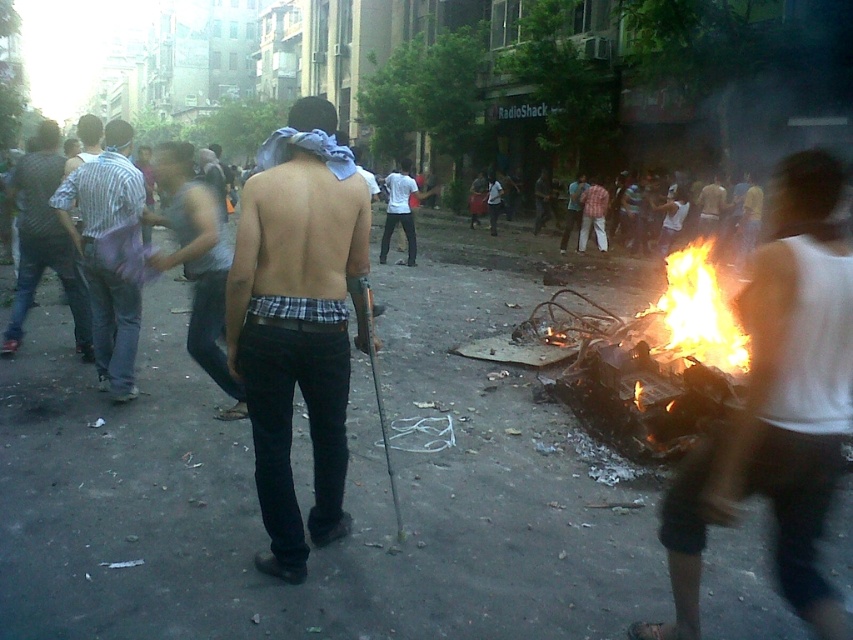
Question: Which point is closer to the camera taking this photo?

Choices:
 (A) (271, 307)
 (B) (759, 358)

Answer: (B)

Question: Which object appears farthest from the camera in this image?

Choices:
 (A) white cotton tank top at right
 (B) striped shirt at center

Answer: (B)

Question: Can you confirm if white cotton tank top at right is smaller than flaming debris at center?

Choices:
 (A) no
 (B) yes

Answer: (B)

Question: In this image, where is striped shirt at center located relative to flaming debris at center?

Choices:
 (A) left
 (B) right

Answer: (A)

Question: Is striped shirt at center wider than flaming debris at center?

Choices:
 (A) no
 (B) yes

Answer: (A)

Question: Which object is farther from the camera taking this photo?

Choices:
 (A) white shirt at center
 (B) striped shirt at left
 (C) plaid fabric shirt at center
 (D) white cotton tank top at right

Answer: (A)